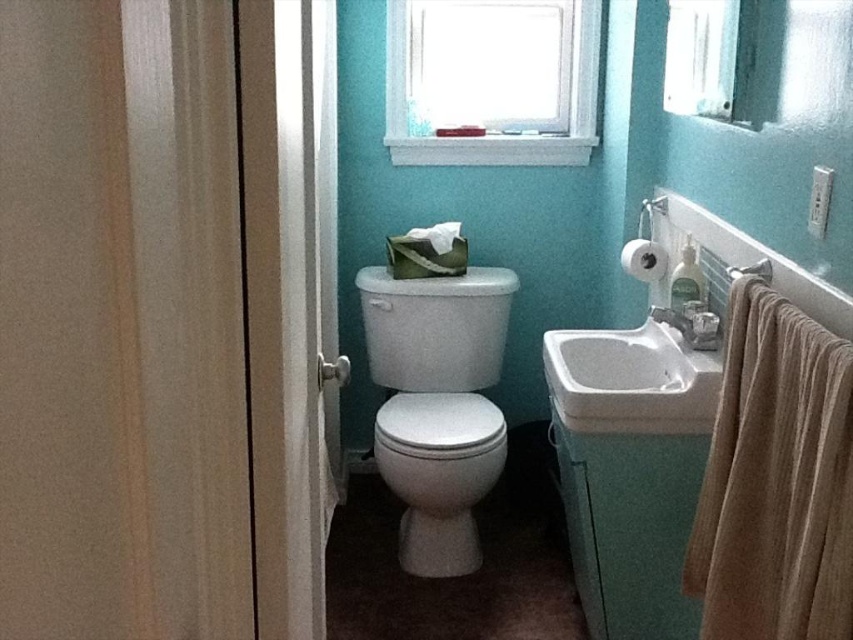
Who is higher up, white plastic window at upper center or white glossy toilet bowl at center?

white plastic window at upper center is above.

Based on the photo, which is more to the right, white plastic window at upper center or white glossy toilet bowl at center?

Positioned to the right is white plastic window at upper center.

Is point (390, 3) less distant than point (389, 397)?

Yes, point (390, 3) is in front of point (389, 397).

Locate an element on the screen. The height and width of the screenshot is (640, 853). white plastic window at upper center is located at coordinates (492, 81).

Is point (695, 76) positioned in front of point (766, 272)?

No, (695, 76) is further to viewer.

This screenshot has height=640, width=853. Describe the element at coordinates (704, 54) in the screenshot. I see `clear glass window at upper right` at that location.

Find the location of a particular element. The width and height of the screenshot is (853, 640). clear glass window at upper right is located at coordinates (704, 54).

What do you see at coordinates (492, 81) in the screenshot? I see `white plastic window at upper center` at bounding box center [492, 81].

Can you confirm if white plastic window at upper center is positioned to the right of white glossy sink at center?

Incorrect, white plastic window at upper center is not on the right side of white glossy sink at center.

The height and width of the screenshot is (640, 853). What do you see at coordinates (492, 81) in the screenshot?
I see `white plastic window at upper center` at bounding box center [492, 81].

Find the location of `white plastic window at upper center`. white plastic window at upper center is located at coordinates (492, 81).